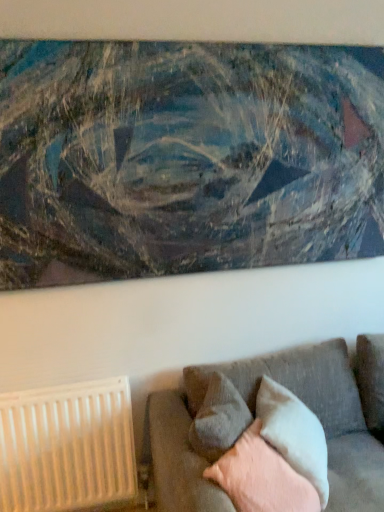
Question: Is gray fabric pillow at lower center, positioned as the 2th pillow in front-to-back order, smaller than textured gray couch at lower right?

Choices:
 (A) no
 (B) yes

Answer: (B)

Question: From a real-world perspective, is gray fabric pillow at lower center, positioned as the 2th pillow in front-to-back order, located beneath textured gray couch at lower right?

Choices:
 (A) yes
 (B) no

Answer: (B)

Question: Can you confirm if gray fabric pillow at lower center, positioned as the 2th pillow in front-to-back order, is positioned to the left of textured gray couch at lower right?

Choices:
 (A) no
 (B) yes

Answer: (B)

Question: Does gray fabric pillow at lower center, positioned as the 2th pillow in front-to-back order, touch textured gray couch at lower right?

Choices:
 (A) no
 (B) yes

Answer: (A)

Question: Does gray fabric pillow at lower center, positioned as the 2th pillow in front-to-back order, come in front of textured gray couch at lower right?

Choices:
 (A) no
 (B) yes

Answer: (A)

Question: Looking at the image, does gray fabric pillow at lower center, positioned as the 2th pillow in front-to-back order, seem bigger or smaller compared to textured canvas painting at upper center?

Choices:
 (A) big
 (B) small

Answer: (B)

Question: From a real-world perspective, is gray fabric pillow at lower center, positioned as the 2th pillow in front-to-back order, physically located above or below textured canvas painting at upper center?

Choices:
 (A) above
 (B) below

Answer: (B)

Question: Looking at their shapes, would you say gray fabric pillow at lower center, positioned as the 2th pillow in front-to-back order, is wider or thinner than textured canvas painting at upper center?

Choices:
 (A) wide
 (B) thin

Answer: (A)

Question: From the image's perspective, is gray fabric pillow at lower center, which is the 2th pillow in back-to-front order, above or below textured canvas painting at upper center?

Choices:
 (A) below
 (B) above

Answer: (A)

Question: Considering the positions of soft gray cushion at lower right, which is the 3th pillow from back to front, and textured canvas painting at upper center in the image, is soft gray cushion at lower right, which is the 3th pillow from back to front, taller or shorter than textured canvas painting at upper center?

Choices:
 (A) short
 (B) tall

Answer: (A)

Question: In terms of width, does soft gray cushion at lower right, which is the 3th pillow from back to front, look wider or thinner when compared to textured canvas painting at upper center?

Choices:
 (A) wide
 (B) thin

Answer: (A)

Question: Considering their positions, is soft gray cushion at lower right, arranged as the first pillow when viewed from the front, located in front of or behind textured canvas painting at upper center?

Choices:
 (A) front
 (B) behind

Answer: (A)

Question: Visually, is soft gray cushion at lower right, which is the 3th pillow from back to front, positioned to the left or to the right of textured canvas painting at upper center?

Choices:
 (A) left
 (B) right

Answer: (B)

Question: Which is correct: gray fabric pillow at lower center, positioned as the 2th pillow in front-to-back order, is inside light gray fabric pillow at lower right, which ranks as the first pillow in back-to-front order, or outside of it?

Choices:
 (A) inside
 (B) outside

Answer: (B)

Question: From a real-world perspective, is gray fabric pillow at lower center, positioned as the 2th pillow in front-to-back order, physically located above or below light gray fabric pillow at lower right, which ranks as the first pillow in back-to-front order?

Choices:
 (A) above
 (B) below

Answer: (A)